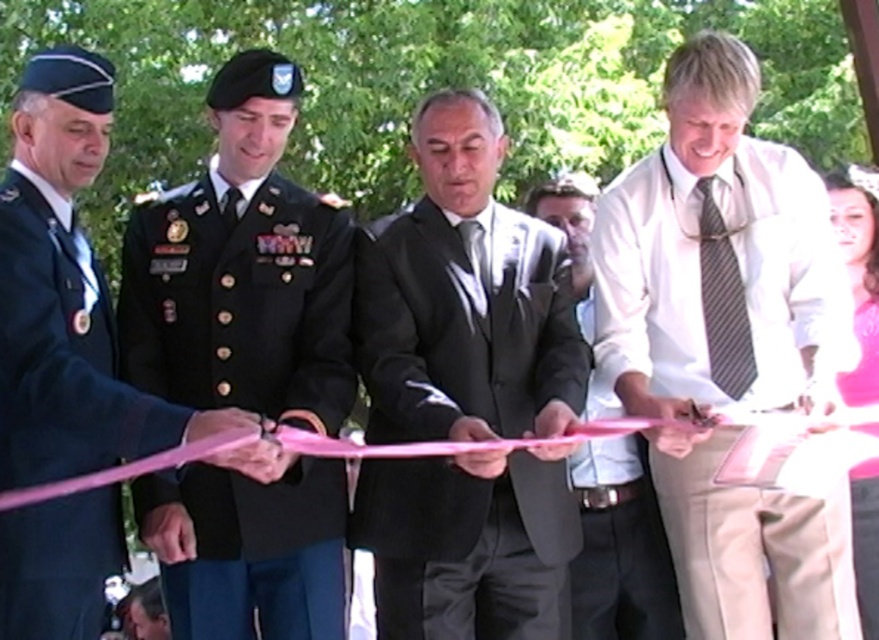
Between matte black suit at center and white shirt at center, which one has less height?

white shirt at center

Is point (391, 636) farther from viewer compared to point (608, 611)?

No, it is in front of (608, 611).

Find the location of a particular element. The image size is (879, 640). matte black suit at center is located at coordinates (465, 298).

Who is more distant from viewer, (224, 502) or (600, 381)?

The point (600, 381) is more distant.

What do you see at coordinates (240, 300) in the screenshot? Image resolution: width=879 pixels, height=640 pixels. I see `dark green military uniform at center` at bounding box center [240, 300].

Who is more distant from viewer, (212, 360) or (603, 445)?

The point (603, 445) is more distant.

Identify the location of dark green military uniform at center. (240, 300).

Who is shorter, dark blue fabric uniform at left or pink satin dress at lower right?

Standing shorter between the two is pink satin dress at lower right.

Is point (71, 321) positioned behind point (861, 387)?

No, (71, 321) is in front of (861, 387).

Find the location of a particular element. dark blue fabric uniform at left is located at coordinates (62, 352).